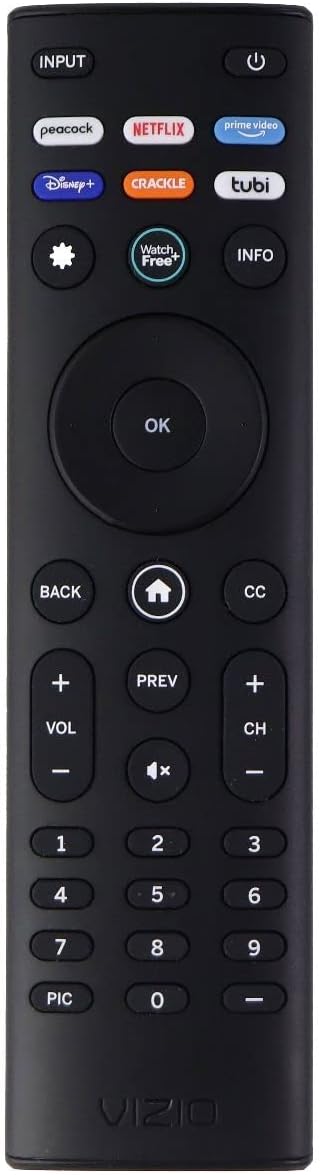
Locate an element on the screen. Image resolution: width=320 pixels, height=1175 pixels. remote buttons for apps on tv is located at coordinates (79, 137), (153, 129), (229, 120), (245, 174), (176, 180), (70, 179), (149, 247).